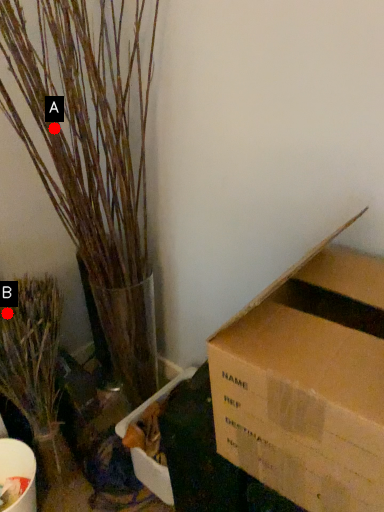
Question: Two points are circled on the image, labeled by A and B beside each circle. Which point is closer to the camera?

Choices:
 (A) A is closer
 (B) B is closer

Answer: (B)